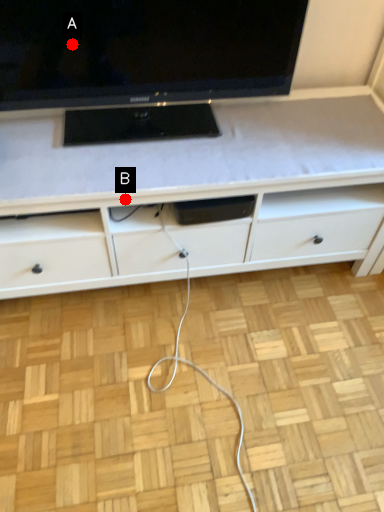
Question: Two points are circled on the image, labeled by A and B beside each circle. Which of the following is the closest to the observer?

Choices:
 (A) A is closer
 (B) B is closer

Answer: (A)